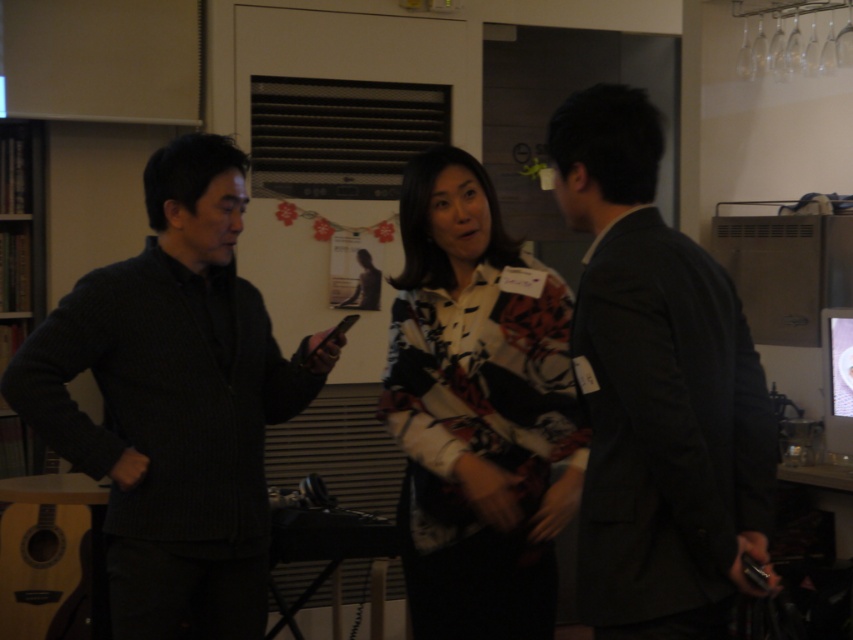
Which is above, dark gray suit at right or floral-patterned shirt at center?

dark gray suit at right

Between dark gray suit at right and floral-patterned shirt at center, which one has more height?

With more height is floral-patterned shirt at center.

Between point (573, 96) and point (502, 362), which one is positioned in front?

Point (573, 96) is in front.

Where is `dark gray suit at right`? dark gray suit at right is located at coordinates (657, 392).

Is dark gray sweater at center to the right of floral-patterned shirt at center from the viewer's perspective?

Incorrect, dark gray sweater at center is not on the right side of floral-patterned shirt at center.

Locate an element on the screen. This screenshot has width=853, height=640. dark gray sweater at center is located at coordinates (173, 403).

Describe the element at coordinates (173, 403) in the screenshot. This screenshot has width=853, height=640. I see `dark gray sweater at center` at that location.

Measure the distance between point (x=163, y=371) and camera.

Point (x=163, y=371) is 2.13 meters away from camera.

Which is behind, point (59, 356) or point (654, 612)?

The point (59, 356) is more distant.

Identify the location of dark gray sweater at center. (173, 403).